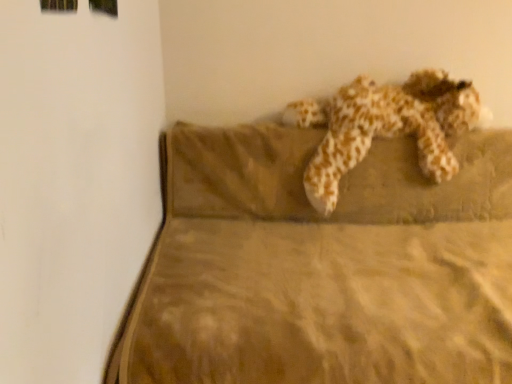
Question: Is fluffy beige stuffed animal at center positioned behind brown velvety mattress at upper right?

Choices:
 (A) yes
 (B) no

Answer: (A)

Question: Is the position of fluffy beige stuffed animal at center less distant than that of brown velvety mattress at upper right?

Choices:
 (A) no
 (B) yes

Answer: (A)

Question: Does fluffy beige stuffed animal at center have a greater width compared to brown velvety mattress at upper right?

Choices:
 (A) no
 (B) yes

Answer: (A)

Question: From a real-world perspective, is fluffy beige stuffed animal at center below brown velvety mattress at upper right?

Choices:
 (A) yes
 (B) no

Answer: (B)

Question: Considering the relative sizes of fluffy beige stuffed animal at center and brown velvety mattress at upper right in the image provided, is fluffy beige stuffed animal at center thinner than brown velvety mattress at upper right?

Choices:
 (A) yes
 (B) no

Answer: (A)

Question: Considering the relative sizes of fluffy beige stuffed animal at center and brown velvety mattress at upper right in the image provided, is fluffy beige stuffed animal at center shorter than brown velvety mattress at upper right?

Choices:
 (A) no
 (B) yes

Answer: (B)

Question: Is brown velvety mattress at upper right directly adjacent to fluffy beige stuffed animal at center?

Choices:
 (A) yes
 (B) no

Answer: (B)

Question: Considering the relative sizes of brown velvety mattress at upper right and fluffy beige stuffed animal at center in the image provided, is brown velvety mattress at upper right thinner than fluffy beige stuffed animal at center?

Choices:
 (A) yes
 (B) no

Answer: (B)

Question: Is brown velvety mattress at upper right to the left of fluffy beige stuffed animal at center from the viewer's perspective?

Choices:
 (A) yes
 (B) no

Answer: (A)

Question: Considering the relative positions of brown velvety mattress at upper right and fluffy beige stuffed animal at center in the image provided, is brown velvety mattress at upper right in front of fluffy beige stuffed animal at center?

Choices:
 (A) yes
 (B) no

Answer: (A)

Question: From a real-world perspective, is brown velvety mattress at upper right physically below fluffy beige stuffed animal at center?

Choices:
 (A) no
 (B) yes

Answer: (B)

Question: From a real-world perspective, is brown velvety mattress at upper right over fluffy beige stuffed animal at center?

Choices:
 (A) yes
 (B) no

Answer: (B)

Question: Considering the relative positions of brown velvety mattress at upper right and fluffy beige stuffed animal at center in the image provided, is brown velvety mattress at upper right to the left or to the right of fluffy beige stuffed animal at center?

Choices:
 (A) left
 (B) right

Answer: (A)